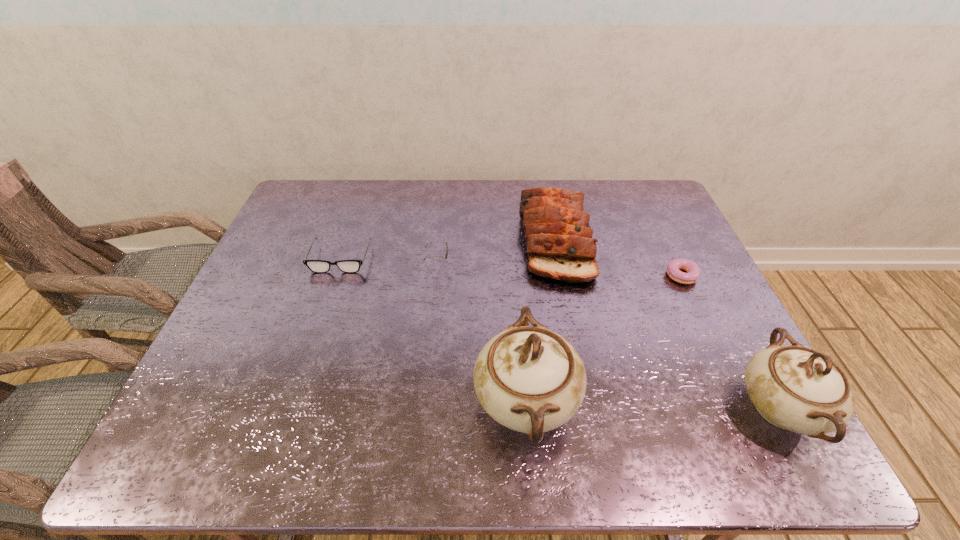
Where is `vacant space that's between the fourth shortest object and the left chinaware`? This screenshot has height=540, width=960. vacant space that's between the fourth shortest object and the left chinaware is located at coordinates (540, 321).

Identify the location of empty space between the third shortest object and the third tallest object. (495, 252).

Find the location of a particular element. Image resolution: width=960 pixels, height=540 pixels. vacant area that lies between the fourth shortest object and the shorter chinaware is located at coordinates (666, 324).

Find the location of a particular element. free spot between the shortest object and the bread is located at coordinates (618, 259).

You are a GUI agent. You are given a task and a screenshot of the screen. Output one action in this format:
    pyautogui.click(x=<x>, y=<y>)
    Task: Click on the free area in between the leftmost object and the taller chinaware
    The height and width of the screenshot is (540, 960).
    Given the screenshot: What is the action you would take?
    pyautogui.click(x=433, y=330)

This screenshot has width=960, height=540. Find the location of `vacant point located between the doughnut and the right chinaware`. vacant point located between the doughnut and the right chinaware is located at coordinates (732, 343).

Select which object is the fifth closest to the second object from left to right. Please provide its 2D coordinates. Your answer should be formatted as a tuple, i.e. [(x, y)], where the tuple contains the x and y coordinates of a point satisfying the conditions above.

[(795, 388)]

Locate which object ranks fifth in proximity to the shortest object. Please provide its 2D coordinates. Your answer should be formatted as a tuple, i.e. [(x, y)], where the tuple contains the x and y coordinates of a point satisfying the conditions above.

[(317, 266)]

Identify the location of vacant area in the image that satisfies the following two spatial constraints: 1. on the front-facing side of the right chinaware; 2. on the left side of the spectacles. (289, 409).

You are a GUI agent. You are given a task and a screenshot of the screen. Output one action in this format:
    pyautogui.click(x=<x>, y=<y>)
    Task: Click on the vacant space that satisfies the following two spatial constraints: 1. on the front-facing side of the leftmost object; 2. on the left side of the tallest object
    This screenshot has height=540, width=960.
    Given the screenshot: What is the action you would take?
    pyautogui.click(x=291, y=402)